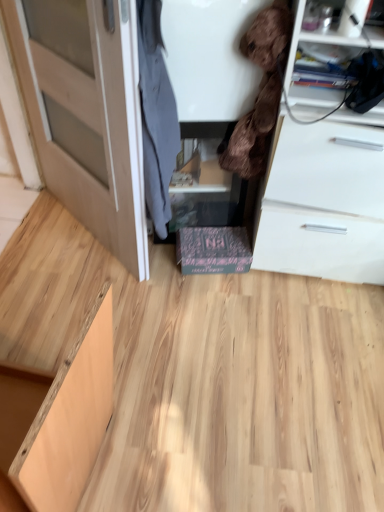
Find the location of `transparent glass door at left`. transparent glass door at left is located at coordinates tap(72, 82).

Identify the location of light brown wood door at left. (87, 114).

Locate an element on the screen. dark gray fabric coat at center, positioned as the 1th clothing in left-to-right order is located at coordinates (156, 116).

What do you see at coordinates (213, 250) in the screenshot? This screenshot has width=384, height=512. I see `black cardboard box at center, positioned as the second cabinetry in left-to-right order` at bounding box center [213, 250].

Describe the element at coordinates (69, 420) in the screenshot. The image size is (384, 512). I see `light wood cabinet at lower left, the 2th cabinetry in the back-to-front sequence` at that location.

Locate an element on the screen. This screenshot has height=512, width=384. transparent glass door at left is located at coordinates (72, 82).

Identify the location of door located on the left of dark gray fabric coat at center, positioned as the 1th clothing in left-to-right order. (87, 114).

In terms of width, does light brown wood door at left look wider or thinner when compared to dark gray fabric coat at center, which is the 2th clothing from right to left?

light brown wood door at left is thinner than dark gray fabric coat at center, which is the 2th clothing from right to left.

From the image's perspective, which one is positioned lower, light brown wood door at left or dark gray fabric coat at center, positioned as the 1th clothing in left-to-right order?

dark gray fabric coat at center, positioned as the 1th clothing in left-to-right order.

In the image, is brown plush toy at upper right, the second clothing positioned from the left, positioned in front of or behind light brown wood door at left?

brown plush toy at upper right, the second clothing positioned from the left, is positioned farther from the viewer than light brown wood door at left.

Could you measure the distance between brown plush toy at upper right, acting as the first clothing starting from the right, and light brown wood door at left?

brown plush toy at upper right, acting as the first clothing starting from the right, and light brown wood door at left are 21.31 inches apart.

Based on the photo, is brown plush toy at upper right, acting as the first clothing starting from the right, in contact with light brown wood door at left?

No, brown plush toy at upper right, acting as the first clothing starting from the right, is not in contact with light brown wood door at left.

From the image's perspective, is brown plush toy at upper right, acting as the first clothing starting from the right, positioned above or below light brown wood door at left?

Based on their image positions, brown plush toy at upper right, acting as the first clothing starting from the right, is located above light brown wood door at left.

Who is more distant, transparent glass door at left or dark gray fabric coat at center, positioned as the 1th clothing in left-to-right order?

transparent glass door at left is further away from the camera.

Considering the sizes of transparent glass door at left and dark gray fabric coat at center, positioned as the 1th clothing in left-to-right order, in the image, is transparent glass door at left taller or shorter than dark gray fabric coat at center, positioned as the 1th clothing in left-to-right order,?

In the image, transparent glass door at left appears to be shorter than dark gray fabric coat at center, positioned as the 1th clothing in left-to-right order.

The image size is (384, 512). What are the coordinates of `clothing that is the 1st object above the transparent glass door at left (from a real-world perspective)` in the screenshot? It's located at (156, 116).

Is point (65, 95) positioned after point (147, 8)?

Yes, point (65, 95) is farther from viewer.

From the image's perspective, is dark gray fabric coat at center, positioned as the 1th clothing in left-to-right order, positioned above or below light brown wood door at left?

dark gray fabric coat at center, positioned as the 1th clothing in left-to-right order, is situated lower than light brown wood door at left in the image.

Looking at this image, how different are the orientations of dark gray fabric coat at center, which is the 2th clothing from right to left, and light brown wood door at left in degrees?

They differ by 55.4 degrees in their facing directions.

Between dark gray fabric coat at center, which is the 2th clothing from right to left, and light brown wood door at left, which one has larger size?

light brown wood door at left is bigger.

Between dark gray fabric coat at center, which is the 2th clothing from right to left, and light brown wood door at left, which one has smaller width?

light brown wood door at left.

Consider the image. Could you tell me if natural wood plywood at center is facing transparent glass door at left?

No, natural wood plywood at center is not oriented towards transparent glass door at left.

Locate an element on the screen. The image size is (384, 512). glass door behind the natural wood plywood at center is located at coordinates (72, 82).

Between natural wood plywood at center and transparent glass door at left, which one appears on the right side from the viewer's perspective?

From the viewer's perspective, natural wood plywood at center appears more on the right side.

Is point (165, 287) closer or farther from the camera than point (49, 70)?

Point (165, 287).

Does light brown wood door at left have a larger size compared to natural wood plywood at center?

Actually, light brown wood door at left might be smaller than natural wood plywood at center.

Consider the image. Is light brown wood door at left surrounding natural wood plywood at center?

No, natural wood plywood at center is not a part of light brown wood door at left.

What are the coordinates of `door above the natural wood plywood at center (from a real-world perspective)` in the screenshot? It's located at (87, 114).

From the image's perspective, between light brown wood door at left and natural wood plywood at center, which one is located above?

From the image's view, light brown wood door at left is above.

Is transparent glass door at left wider than light wood cabinet at lower left, the 2th cabinetry in the back-to-front sequence?

Correct, the width of transparent glass door at left exceeds that of light wood cabinet at lower left, the 2th cabinetry in the back-to-front sequence.

Is transparent glass door at left beside light wood cabinet at lower left, the 2th cabinetry in the back-to-front sequence?

No, transparent glass door at left is not making contact with light wood cabinet at lower left, the 2th cabinetry in the back-to-front sequence.

Which of these two, transparent glass door at left or light wood cabinet at lower left, which ranks as the first cabinetry in left-to-right order, is smaller?

With smaller size is transparent glass door at left.

Considering their positions, is transparent glass door at left located in front of or behind light wood cabinet at lower left, acting as the first cabinetry starting from the front?

transparent glass door at left is positioned farther from the viewer than light wood cabinet at lower left, acting as the first cabinetry starting from the front.

You are a GUI agent. You are given a task and a screenshot of the screen. Output one action in this format:
    pyautogui.click(x=<x>, y=<y>)
    Task: Click on the 1st clothing to the right of the light brown wood door at left, starting your count from the anchor
    
    Given the screenshot: What is the action you would take?
    pyautogui.click(x=156, y=116)

At what (x,y) coordinates should I click in order to perform the action: click on clothing located above the light brown wood door at left (from the image's perspective). Please return your answer as a coordinate pair (x, y). The width and height of the screenshot is (384, 512). Looking at the image, I should click on (260, 91).

Considering their positions, is dark gray fabric coat at center, which is the 2th clothing from right to left, positioned closer to natural wood plywood at center than black cardboard box at center, positioned as the second cabinetry in left-to-right order?

black cardboard box at center, positioned as the second cabinetry in left-to-right order.

From the picture: Considering their positions, is natural wood plywood at center positioned further to black cardboard box at center, marked as the 1th cabinetry in a right-to-left arrangement, than light brown wood door at left?

Based on the image, light brown wood door at left appears to be further to black cardboard box at center, marked as the 1th cabinetry in a right-to-left arrangement.

Which object lies nearer to the anchor point light wood cabinet at lower left, which is the second cabinetry from right to left, black cardboard box at center, which is counted as the 2th cabinetry, starting from the front, or natural wood plywood at center?

Among the two, natural wood plywood at center is located nearer to light wood cabinet at lower left, which is the second cabinetry from right to left.

When comparing their distances from dark gray fabric coat at center, which is the 2th clothing from right to left, does light wood cabinet at lower left, the 2th cabinetry in the back-to-front sequence, or black cardboard box at center, which is counted as the 2th cabinetry, starting from the front, seem closer?

black cardboard box at center, which is counted as the 2th cabinetry, starting from the front.

Considering their positions, is black cardboard box at center, marked as the 1th cabinetry in a right-to-left arrangement, positioned closer to brown plush toy at upper right, the second clothing positioned from the left, than transparent glass door at left?

Among the two, black cardboard box at center, marked as the 1th cabinetry in a right-to-left arrangement, is located nearer to brown plush toy at upper right, the second clothing positioned from the left.

Considering their positions, is dark gray fabric coat at center, which is the 2th clothing from right to left, positioned closer to natural wood plywood at center than light brown wood door at left?

Based on the image, light brown wood door at left appears to be nearer to natural wood plywood at center.

From the image, which object appears to be farther from brown plush toy at upper right, the second clothing positioned from the left, natural wood plywood at center or transparent glass door at left?

Based on the image, natural wood plywood at center appears to be further to brown plush toy at upper right, the second clothing positioned from the left.

Considering their positions, is natural wood plywood at center positioned closer to light wood cabinet at lower left, which is the second cabinetry from right to left, than brown plush toy at upper right, the second clothing positioned from the left?

Among the two, natural wood plywood at center is located nearer to light wood cabinet at lower left, which is the second cabinetry from right to left.

Where is `plywood between dark gray fabric coat at center, which is the 2th clothing from right to left, and black cardboard box at center, positioned as the second cabinetry in left-to-right order, in the front-back direction`? plywood between dark gray fabric coat at center, which is the 2th clothing from right to left, and black cardboard box at center, positioned as the second cabinetry in left-to-right order, in the front-back direction is located at coordinates (243, 395).

Locate an element on the screen. This screenshot has height=512, width=384. door between transparent glass door at left and natural wood plywood at center in the up-down direction is located at coordinates (87, 114).

Identify the location of glass door between light brown wood door at left and black cardboard box at center, positioned as the second cabinetry in left-to-right order, from front to back. This screenshot has width=384, height=512. pyautogui.click(x=72, y=82).

I want to click on plywood that lies between dark gray fabric coat at center, which is the 2th clothing from right to left, and light wood cabinet at lower left, which ranks as the first cabinetry in left-to-right order, from top to bottom, so click(243, 395).